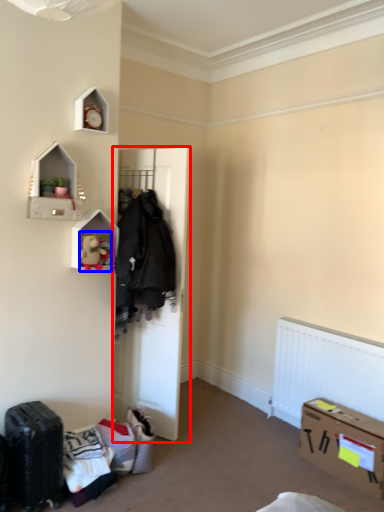
Question: Which point is further to the camera, door (highlighted by a red box) or toy (highlighted by a blue box)?

Choices:
 (A) door
 (B) toy

Answer: (A)